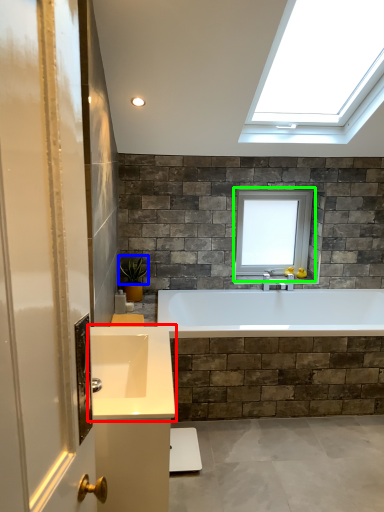
Question: Which object is the farthest from sink (highlighted by a red box)? Choose among these: plant (highlighted by a blue box) or window (highlighted by a green box).

Choices:
 (A) plant
 (B) window

Answer: (B)